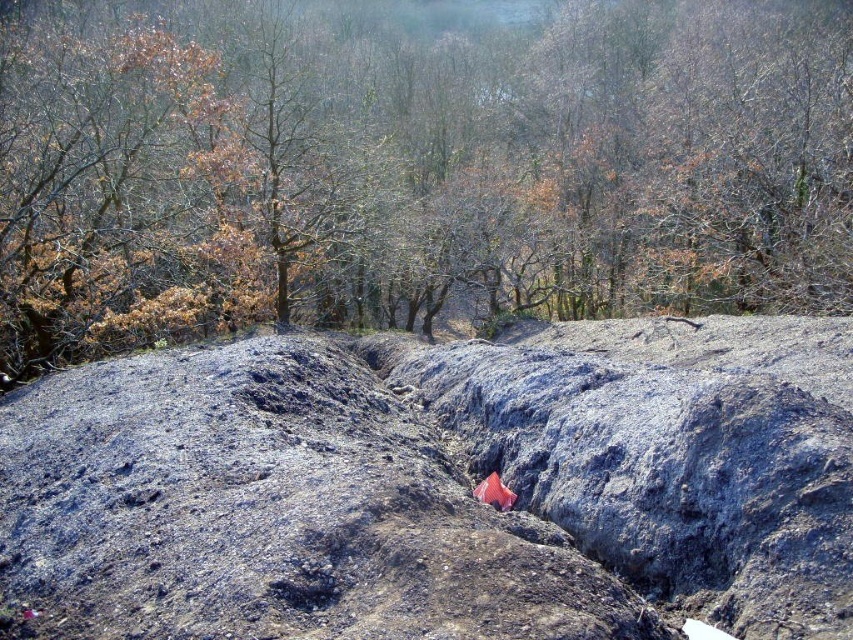
In the scene shown: You are standing at the origin point in the image, which of the two points, point (613, 205) or point (460, 378), is closer to you?

Point (460, 378) is closer to you because it is in front of point (613, 205) according to the description.

In the scene shown: You are a hiker trying to navigate through the rocky terrain. You see a brown leafy tree at upper center and a dull gray rock at center. Which object is taller and would provide better shade from the sun?

The brown leafy tree at upper center is much taller than the dull gray rock at center, so it would provide better shade from the sun.